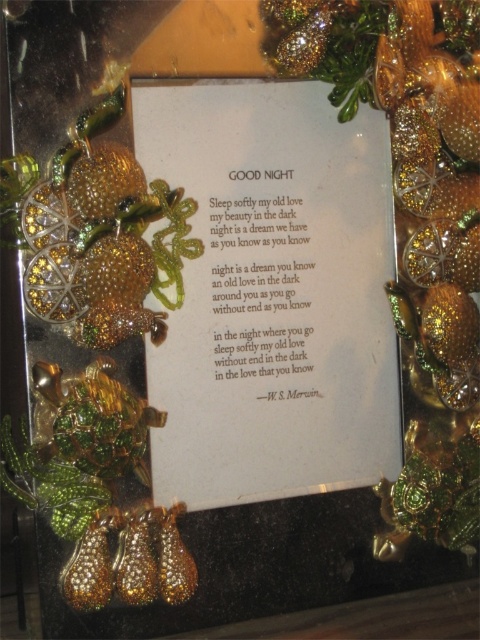
Does white paper at center appear over shiny gold ornament at left?

Correct, white paper at center is located above shiny gold ornament at left.

Based on the photo, is white paper at center positioned at the back of shiny gold ornament at left?

Yes, it is.

What do you see at coordinates (273, 292) in the screenshot? I see `white paper at center` at bounding box center [273, 292].

You are a GUI agent. You are given a task and a screenshot of the screen. Output one action in this format:
    pyautogui.click(x=<x>, y=<y>)
    Task: Click on the white paper at center
    This screenshot has width=480, height=640.
    Given the screenshot: What is the action you would take?
    pyautogui.click(x=273, y=292)

Between point (421, 125) and point (119, 476), which one is positioned in front?

Point (119, 476) is more forward.

What do you see at coordinates (415, 227) in the screenshot? I see `gold glitter ornament at center` at bounding box center [415, 227].

Is point (430, 508) positioned behind point (134, 474)?

Yes, point (430, 508) is behind point (134, 474).

At what (x,y) coordinates should I click in order to perform the action: click on gold glitter ornament at center. Please return your answer as a coordinate pair (x, y). This screenshot has width=480, height=640. Looking at the image, I should click on (415, 227).

Who is positioned more to the right, white paper at center or gold glitter ornament at center?

Positioned to the right is gold glitter ornament at center.

Can you confirm if white paper at center is positioned to the right of gold glitter ornament at center?

Incorrect, white paper at center is not on the right side of gold glitter ornament at center.

The height and width of the screenshot is (640, 480). What do you see at coordinates (273, 292) in the screenshot?
I see `white paper at center` at bounding box center [273, 292].

Locate an element on the screen. The height and width of the screenshot is (640, 480). white paper at center is located at coordinates (273, 292).